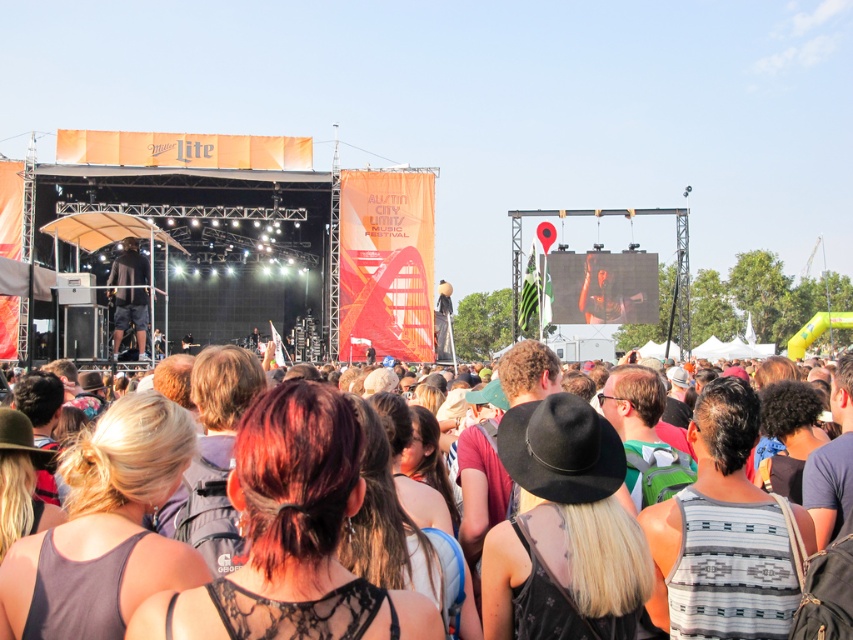
Question: Does multicolored fabric crowd at center have a smaller size compared to black matte shirt at center?

Choices:
 (A) yes
 (B) no

Answer: (B)

Question: Is the position of multicolored fabric crowd at center more distant than that of black matte shirt at center?

Choices:
 (A) yes
 (B) no

Answer: (B)

Question: Can you confirm if multicolored fabric crowd at center is positioned to the left of black matte shirt at center?

Choices:
 (A) no
 (B) yes

Answer: (A)

Question: Which point appears closest to the camera in this image?

Choices:
 (A) (752, 397)
 (B) (142, 337)

Answer: (A)

Question: Which of the following is the closest to the observer?

Choices:
 (A) click(x=134, y=268)
 (B) click(x=583, y=440)

Answer: (B)